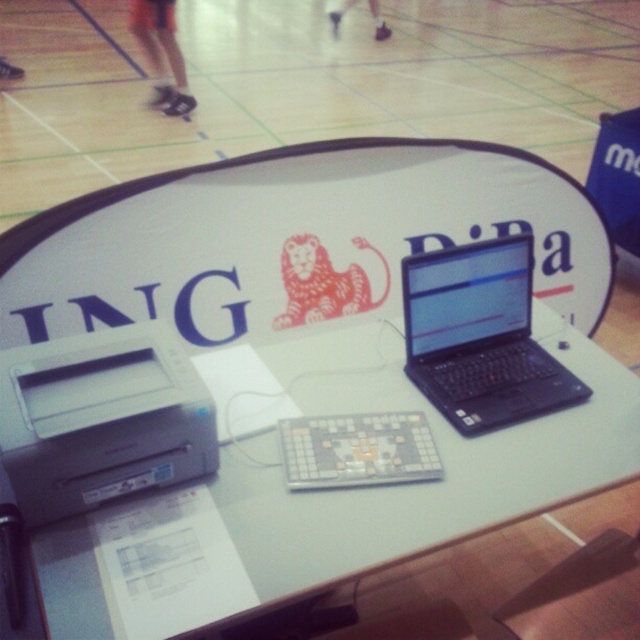
Does white glossy table at center appear under gray plastic printer at lower left?

Yes, white glossy table at center is below gray plastic printer at lower left.

Can you confirm if white glossy table at center is wider than gray plastic printer at lower left?

Indeed, white glossy table at center has a greater width compared to gray plastic printer at lower left.

Who is more distant from viewer, (x=268, y=451) or (x=160, y=451)?

Positioned behind is point (x=268, y=451).

Locate an element on the screen. Image resolution: width=640 pixels, height=640 pixels. white glossy table at center is located at coordinates (332, 490).

Can you confirm if black matte laptop at center is taller than white plastic register at center?

Correct, black matte laptop at center is much taller as white plastic register at center.

Does black matte laptop at center have a lesser height compared to white plastic register at center?

No.

Does point (512, 240) come in front of point (368, 433)?

No, it is not.

This screenshot has height=640, width=640. I want to click on black matte laptop at center, so click(x=481, y=337).

Between white glossy table at center and black matte laptop at center, which one appears on the right side from the viewer's perspective?

Positioned to the right is black matte laptop at center.

Does point (612, 410) lie in front of point (493, 301)?

That is True.

Where is `white glossy table at center`? Image resolution: width=640 pixels, height=640 pixels. white glossy table at center is located at coordinates (332, 490).

Where is `white glossy table at center`? The width and height of the screenshot is (640, 640). white glossy table at center is located at coordinates (332, 490).